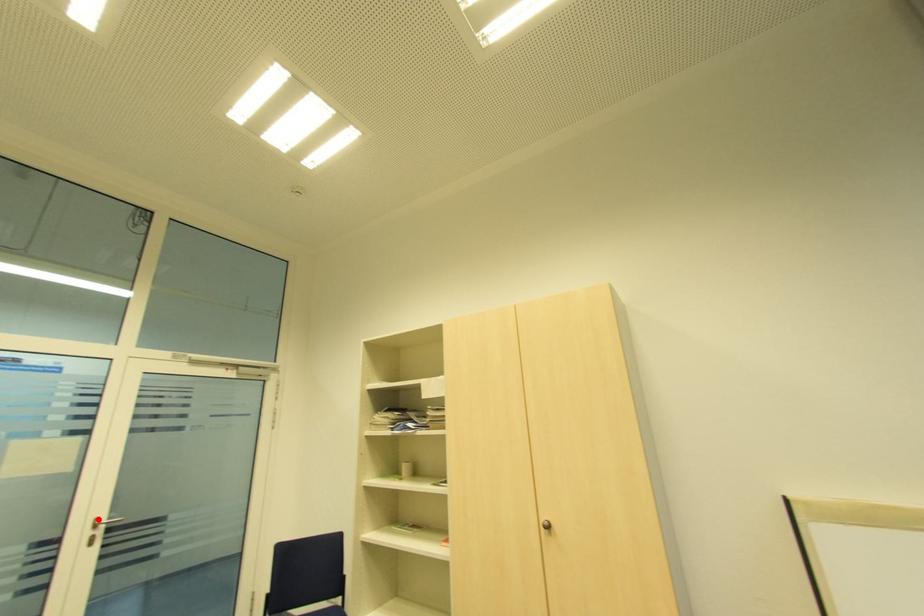
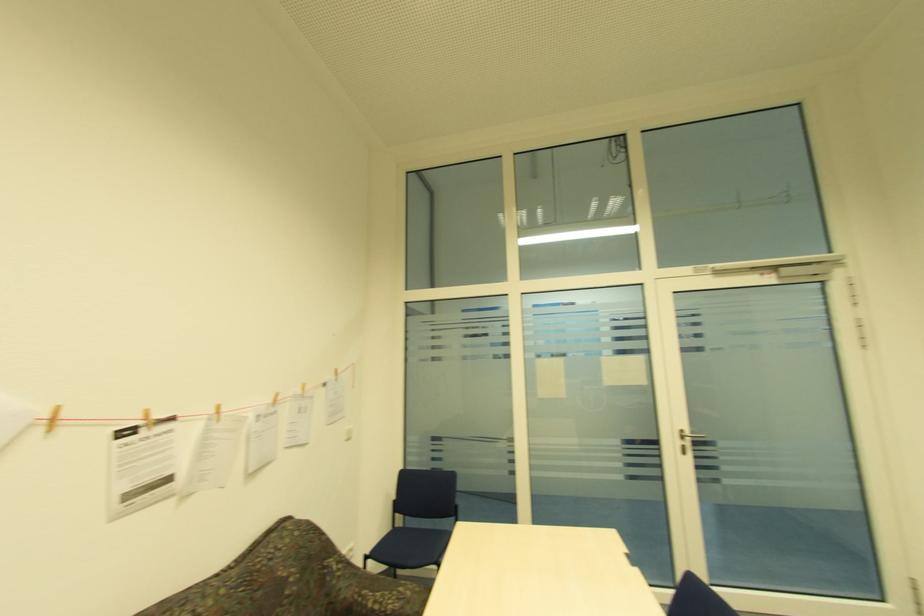
The point at the highlighted location is marked in the first image. Where is the corresponding point in the second image?

(685, 432)